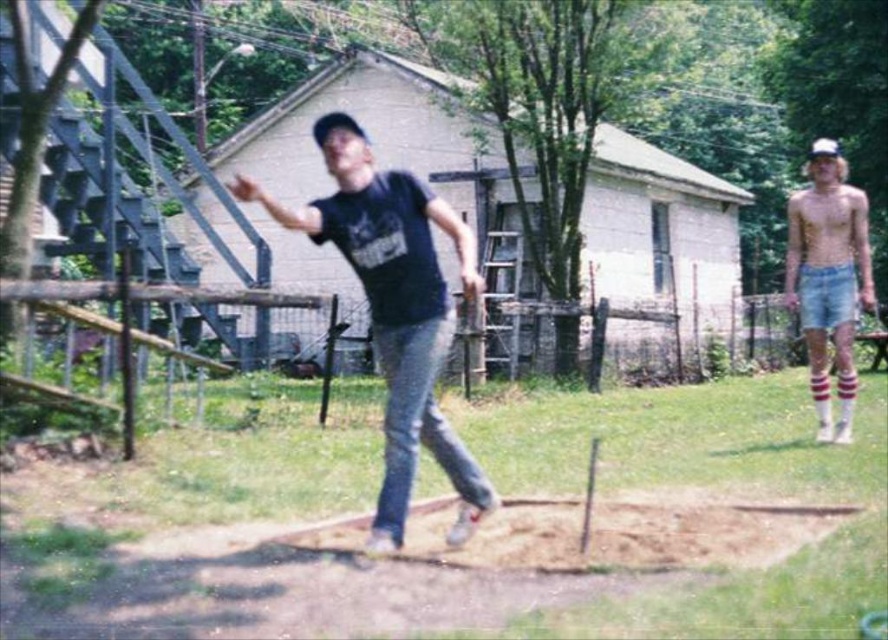
Question: Which of the following is the closest to the observer?

Choices:
 (A) denim shorts at right
 (B) matte black t-shirt at center

Answer: (B)

Question: Can you confirm if matte black t-shirt at center is positioned below denim shorts at right?

Choices:
 (A) yes
 (B) no

Answer: (A)

Question: Is matte black t-shirt at center positioned at the back of denim shorts at right?

Choices:
 (A) yes
 (B) no

Answer: (B)

Question: Which point is farther to the camera?

Choices:
 (A) (858, 276)
 (B) (421, 384)

Answer: (A)

Question: Which of the following is the farthest from the observer?

Choices:
 (A) denim shorts at right
 (B) matte black t-shirt at center

Answer: (A)

Question: Can you confirm if matte black t-shirt at center is positioned to the left of denim shorts at right?

Choices:
 (A) yes
 (B) no

Answer: (A)